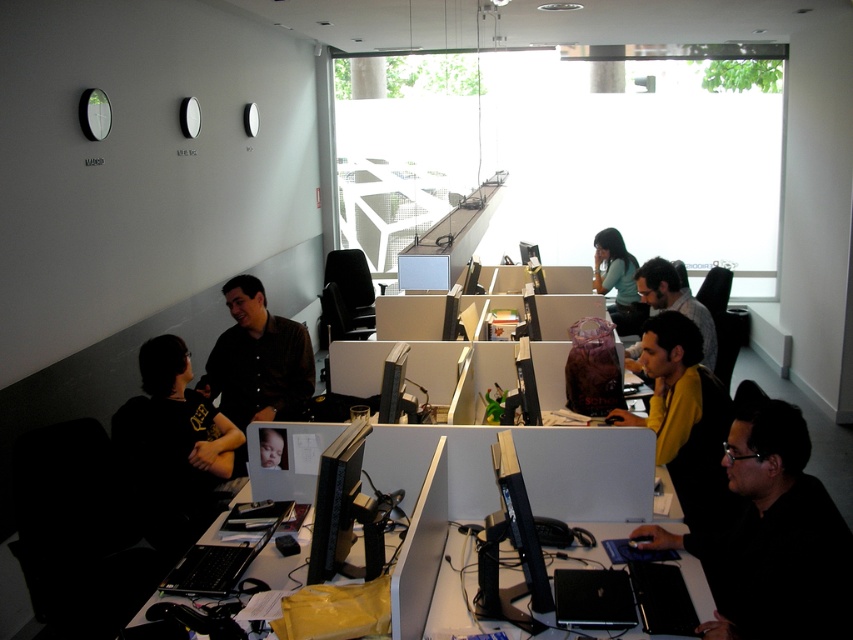
You are an office worker who notices a smooth skin baby at center and a matte teal shirt at center in the office. Which object is closer to you from your perspective?

The matte teal shirt at center is closer to you because the smooth skin baby at center is behind it.

You are an office worker who needs to place a 36.36 inch wide document on your desk. You have a black matte laptop at lower right and a black plastic table at lower right. Can you fit the document between them without moving either object?

The black matte laptop at lower right is 36.36 inches from the black plastic table at lower right, so the document can fit between them as the distance matches the document width.

You are organizing a meeting in the office and need to place a 15cm wide notebook on the desk. The notebook must be placed either on the black matte laptop at lower right or the black plastic table at lower right. Which object can accommodate the notebook without it overhanging?

The black plastic table at lower right can accommodate the notebook without it overhanging because the black matte laptop at lower right has a smaller size compared to the black plastic table at lower right, so the table has enough space.